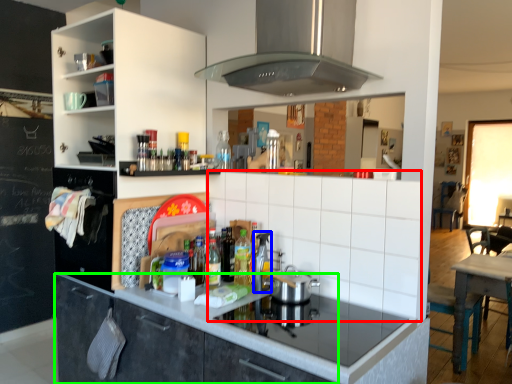
Question: Which object is positioned farthest from tile (highlighted by a red box)? Select from appliance (highlighted by a blue box) and cabinetry (highlighted by a green box).

Choices:
 (A) appliance
 (B) cabinetry

Answer: (B)